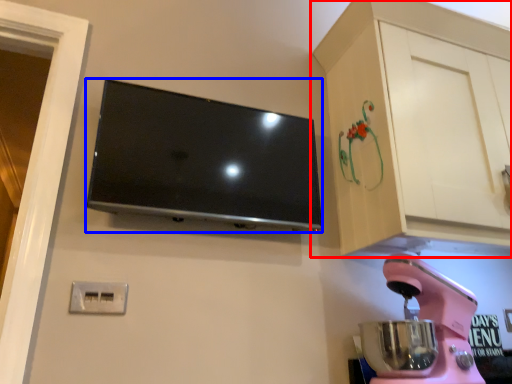
Question: Which of the following is the closest to the observer, cabinetry (highlighted by a red box) or television (highlighted by a blue box)?

Choices:
 (A) cabinetry
 (B) television

Answer: (A)